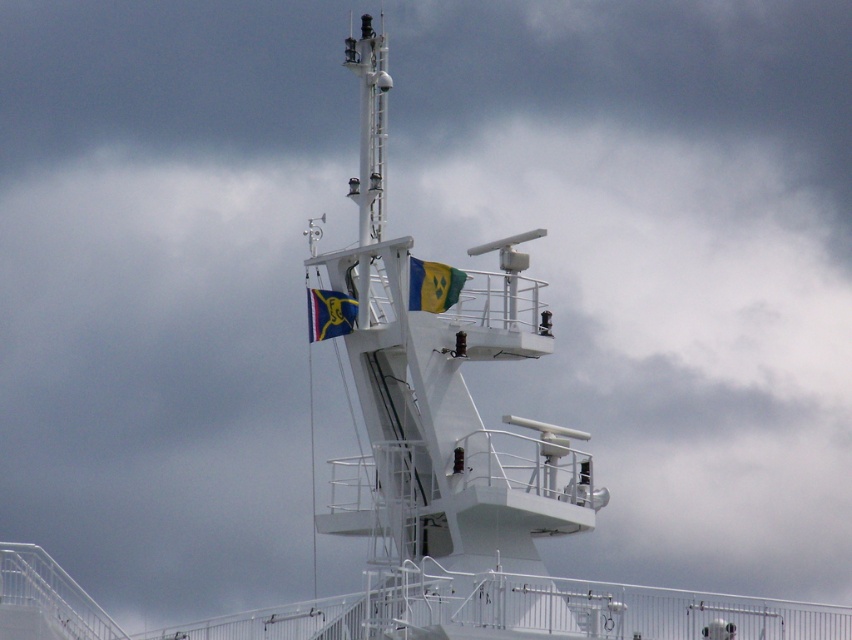
Can you confirm if yellow-green fabric flag at upper center is wider than blue fabric flag at upper center?

No, yellow-green fabric flag at upper center is not wider than blue fabric flag at upper center.

Who is more forward, (x=423, y=285) or (x=354, y=317)?

Positioned in front is point (x=423, y=285).

This screenshot has width=852, height=640. What do you see at coordinates (433, 285) in the screenshot? I see `yellow-green fabric flag at upper center` at bounding box center [433, 285].

At what (x,y) coordinates should I click in order to perform the action: click on yellow-green fabric flag at upper center. Please return your answer as a coordinate pair (x, y). The width and height of the screenshot is (852, 640). Looking at the image, I should click on (433, 285).